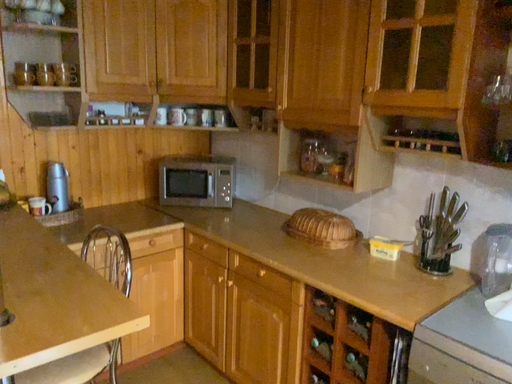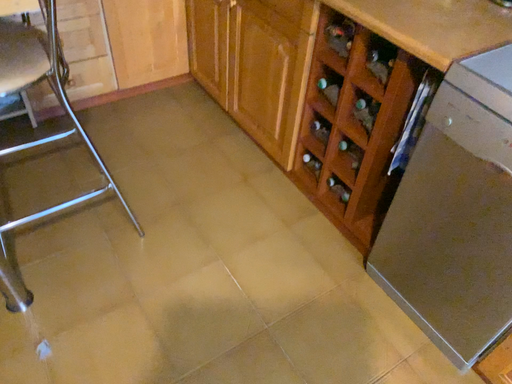
Question: How did the camera likely rotate when shooting the video?

Choices:
 (A) rotated downward
 (B) rotated upward

Answer: (A)